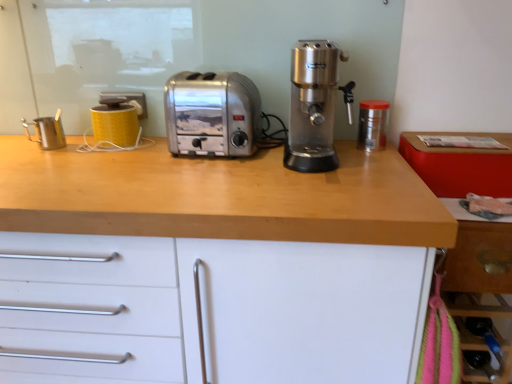
This screenshot has width=512, height=384. I want to click on vacant area that lies between satin silver coffee machine at center and transparent plastic container at right, the 1th kitchen appliance in the right-to-left sequence, so click(357, 148).